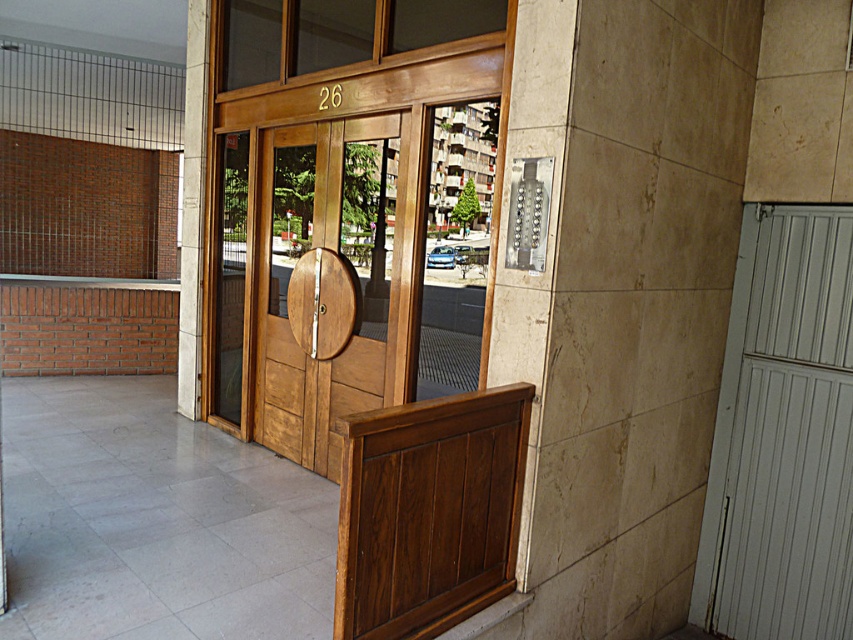
Question: Among these objects, which one is farthest from the camera?

Choices:
 (A) transparent wood door at center
 (B) smooth concrete pillar at left

Answer: (B)

Question: Is transparent wood door at center further to the viewer compared to smooth concrete pillar at left?

Choices:
 (A) no
 (B) yes

Answer: (A)

Question: Is transparent wood door at center thinner than smooth concrete pillar at left?

Choices:
 (A) yes
 (B) no

Answer: (B)

Question: Can you confirm if transparent wood door at center is wider than smooth concrete pillar at left?

Choices:
 (A) yes
 (B) no

Answer: (A)

Question: Which object is farther from the camera taking this photo?

Choices:
 (A) smooth concrete pillar at left
 (B) transparent wood door at center

Answer: (A)

Question: Which of the following is the farthest from the observer?

Choices:
 (A) transparent wood door at center
 (B) smooth concrete pillar at left

Answer: (B)